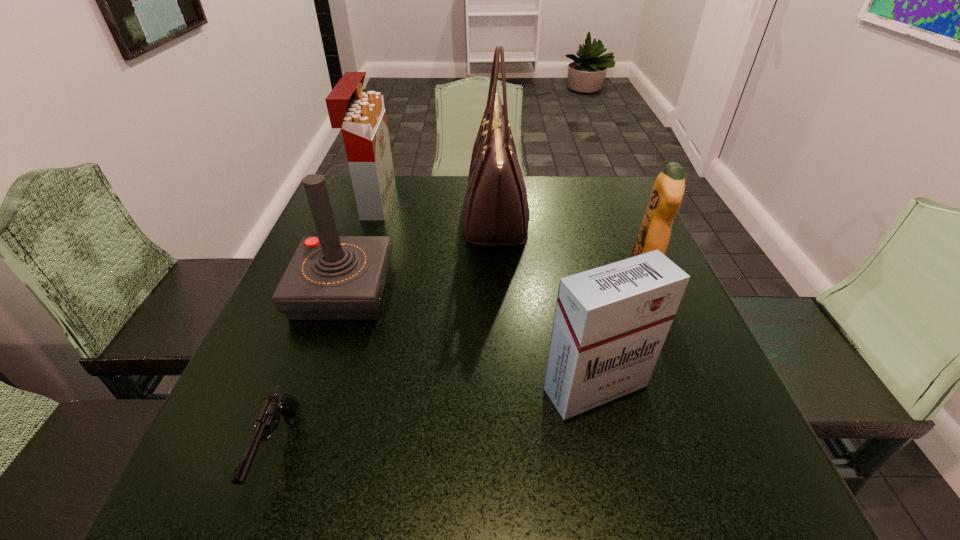
I want to click on free space located on the front-facing side of the handbag, so click(358, 217).

The height and width of the screenshot is (540, 960). I want to click on vacant space situated with the lid open on the farther cigarette case, so click(x=426, y=201).

This screenshot has width=960, height=540. Identify the location of vacant space situated 0.110m on the rectangular base of the joystick. (316, 369).

What are the coordinates of `free location located on the label of the rightmost object` in the screenshot? It's located at (531, 269).

This screenshot has width=960, height=540. What are the coordinates of `free space located on the label of the rightmost object` in the screenshot? It's located at (495, 269).

I want to click on vacant area situated 0.400m on the label of the rightmost object, so click(x=456, y=269).

Where is `vacant space located 0.300m on the back of the nearer cigarette case`? The width and height of the screenshot is (960, 540). vacant space located 0.300m on the back of the nearer cigarette case is located at coordinates (565, 257).

Where is `handbag present at the far edge`? This screenshot has height=540, width=960. handbag present at the far edge is located at coordinates (496, 212).

At what (x,y) coordinates should I click in order to perform the action: click on cigarette case that is at the far edge. Please return your answer as a coordinate pair (x, y). Looking at the image, I should click on (361, 116).

I want to click on object that is at the near edge, so click(x=268, y=418).